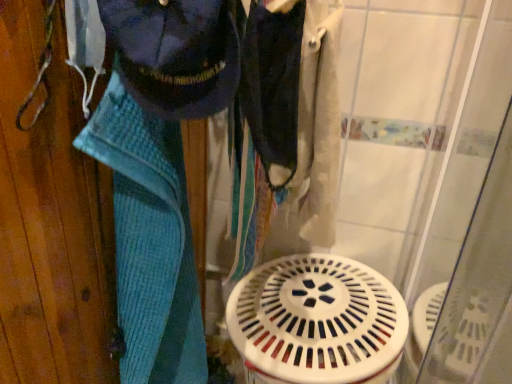
Question: Relative to white plastic water heater at center, is blue knitted towel at left in front or behind?

Choices:
 (A) behind
 (B) front

Answer: (B)

Question: Choose the correct answer: Is blue knitted towel at left inside white plastic water heater at center or outside it?

Choices:
 (A) outside
 (B) inside

Answer: (A)

Question: Estimate the real-world distances between objects in this image. Which object is closer to the navy blue fabric at upper left, acting as the second clothing starting from the right?

Choices:
 (A) dark blue fabric at center, the 1th clothing positioned from the right
 (B) blue knitted towel at left
 (C) white plastic water heater at center

Answer: (A)

Question: Based on their relative distances, which object is nearer to the white plastic water heater at center?

Choices:
 (A) blue knitted towel at left
 (B) navy blue fabric at upper left, marked as the 1th clothing in a left-to-right arrangement
 (C) dark blue fabric at center, which appears as the second clothing when viewed from the left

Answer: (C)